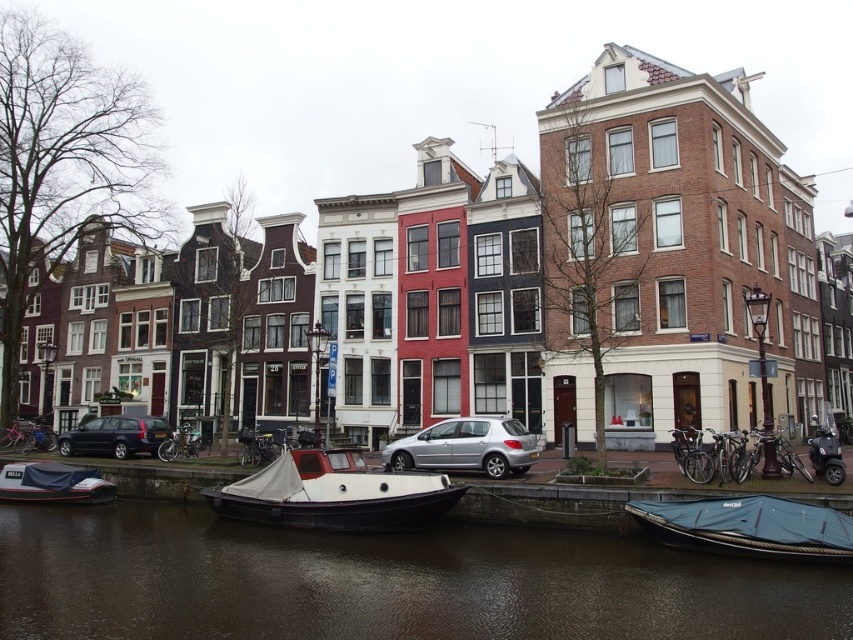
You are a tourist standing on the dock and want to take a photo of the white matte boat at center and the brown water at lower center. Which object will appear closer to the camera in the photo?

The white matte boat at center will appear closer to the camera in the photo because the brown water at lower center is shorter than it.

You are standing at the edge of the canal and want to take a photo. There are two points of interest marked in the scene. The first point is at coordinates point (460, 614) and the second is at point (70, 497). Which point will appear larger in your photo?

Point (460, 614) will appear larger in the photo because it is closer to the camera than point (70, 497).